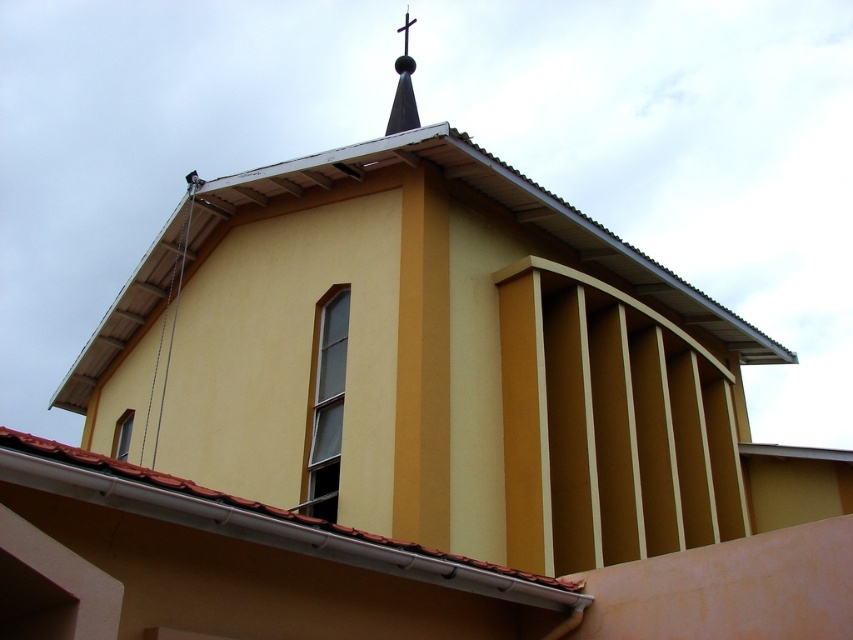
You are a drone operator planning to fly a drone from the metallic gray roof at upper center to the metallic cross at upper center. Given that the drone has a maximum flight range of 12 meters, can it reach the cross?

The distance between the metallic gray roof at upper center and the metallic cross at upper center is 13.30 meters, which exceeds the drone operator maximum flight range of 12 meters. Therefore, the drone cannot reach the cross.

You are standing on the ground in front of the building. Where is the metallic gray roof at upper center located in terms of its coordinates?

The metallic gray roof at upper center is located at coordinates point (x=368, y=188).